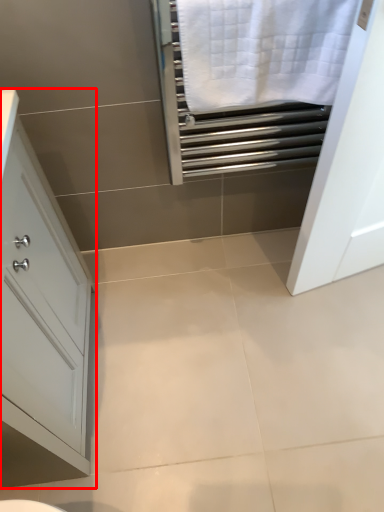
Question: From the image, what is the correct spatial relationship of bathroom cabinet (annotated by the red box) in relation to bath towel?

Choices:
 (A) right
 (B) left

Answer: (B)